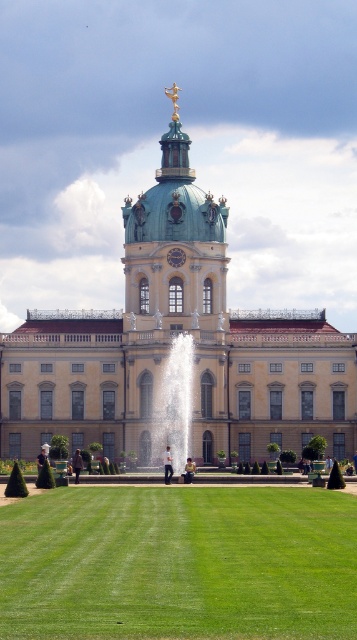
Between beige stone palace at center and green grass at center, which one is positioned lower?

green grass at center

Between point (213, 451) and point (8, 566), which one is positioned in front?

Positioned in front is point (8, 566).

What are the coordinates of `beige stone palace at center` in the screenshot? It's located at (169, 342).

Find the location of a particular element. The height and width of the screenshot is (640, 357). beige stone palace at center is located at coordinates (169, 342).

Which is below, beige stone palace at center or white marble fountain at center?

white marble fountain at center

Is beige stone palace at center positioned at the back of white marble fountain at center?

Yes, it is behind white marble fountain at center.

Is point (299, 428) more distant than point (183, 454)?

Yes, it is.

I want to click on beige stone palace at center, so click(169, 342).

Which is behind, point (139, 580) or point (188, 340)?

The point (188, 340) is more distant.

Is point (133, 499) positioned before point (173, 428)?

Yes, it is.

Where is `green grass at center`? This screenshot has width=357, height=640. green grass at center is located at coordinates (178, 564).

This screenshot has height=640, width=357. Identify the location of green grass at center. click(178, 564).